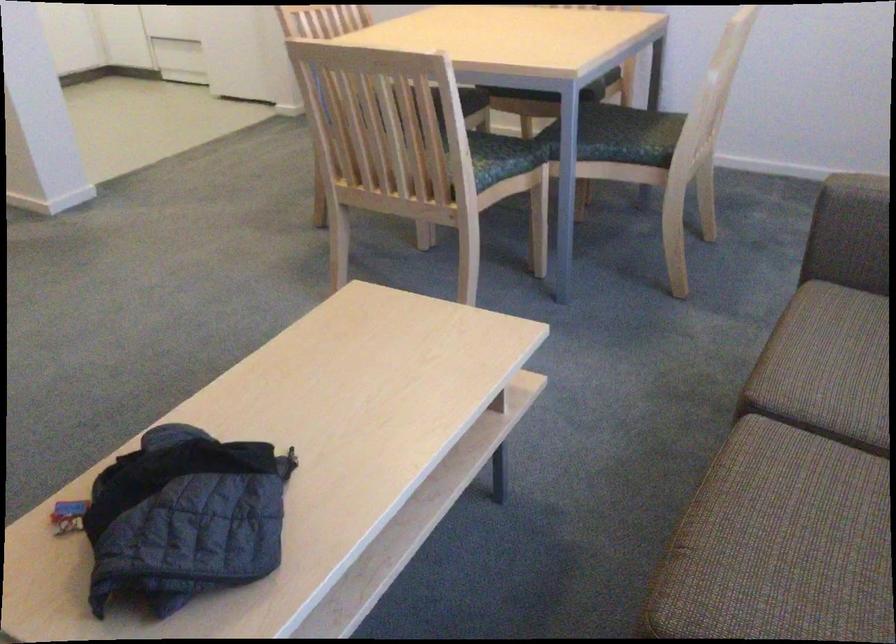
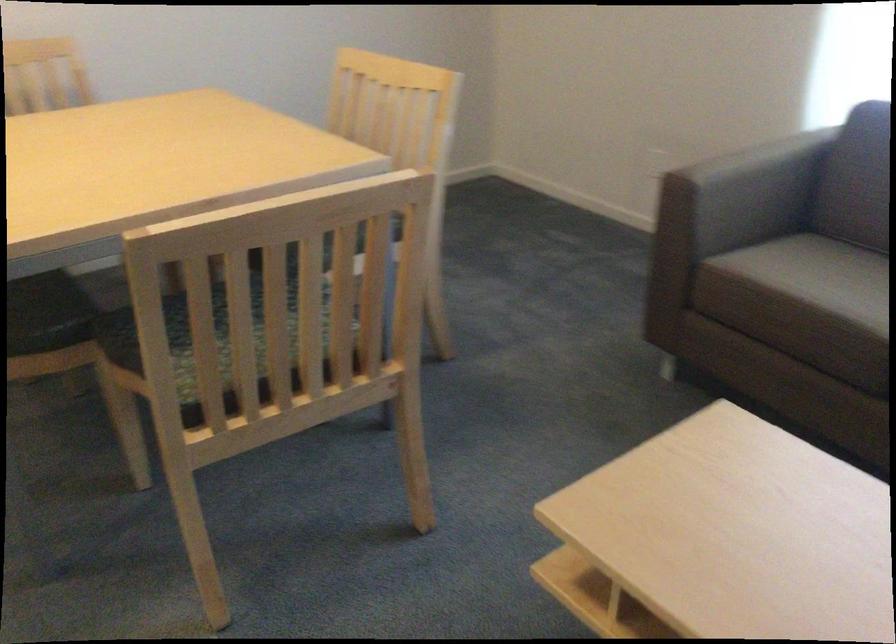
In the second image, find the point that corresponds to point 340,114 in the first image.

(211, 334)